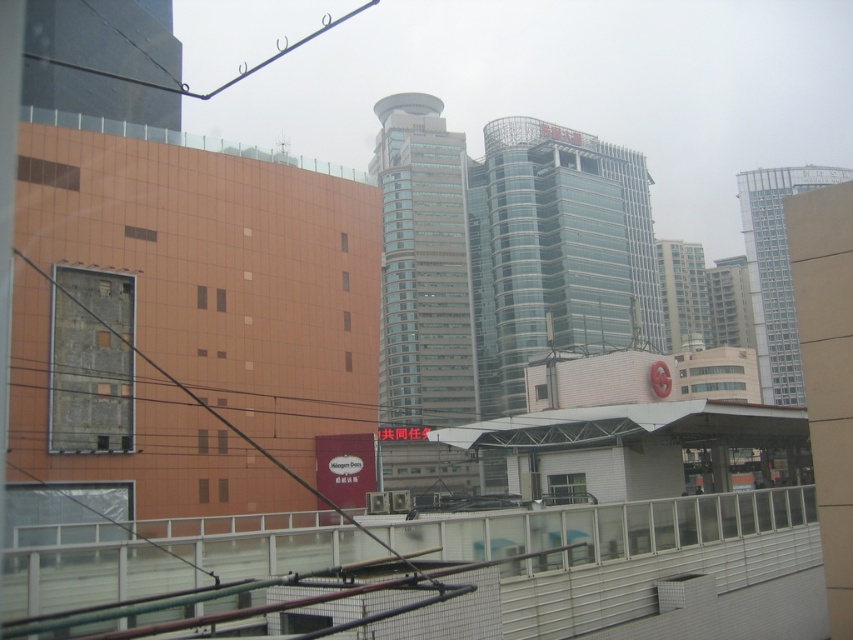
What does the point at coordinates (x=556, y=252) represent in the urban scene?

The point at coordinates (x=556, y=252) indicates a transparent glass tower located at the center of the scene.

You are standing in an urban area and want to take a photo of the transparent glass tower at center. The camera you have can focus on objects up to 60 meters away. Will the tower be in focus?

The transparent glass tower at center is 56.89 meters away from the viewer. Since the camera can focus up to 60 meters, the tower will be within the focus range and should appear sharp in the photo.

You are a city planner evaluating the urban layout. Given the image, which of the two buildings, the glassy modern building at center or the light gray glass tower at right, would require more space for construction due to its size?

The glassy modern building at center is larger in size than the light gray glass tower at right, so it would require more space for construction.